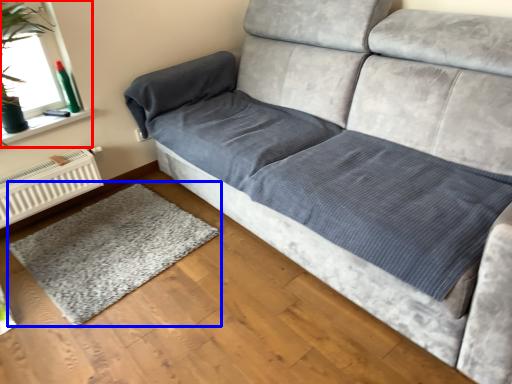
Question: Which of the following is the closest to the observer, window screen (highlighted by a red box) or mat (highlighted by a blue box)?

Choices:
 (A) window screen
 (B) mat

Answer: (B)